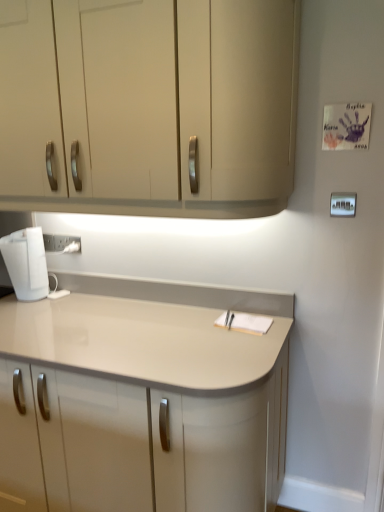
Question: Considering the relative positions of matte beige countertop at center and matte beige cabinet at upper center in the image provided, is matte beige countertop at center in front of matte beige cabinet at upper center?

Choices:
 (A) yes
 (B) no

Answer: (B)

Question: Are matte beige countertop at center and matte beige cabinet at upper center located far from each other?

Choices:
 (A) no
 (B) yes

Answer: (A)

Question: Is matte beige countertop at center oriented away from matte beige cabinet at upper center?

Choices:
 (A) no
 (B) yes

Answer: (A)

Question: From the image's perspective, is matte beige countertop at center under matte beige cabinet at upper center?

Choices:
 (A) yes
 (B) no

Answer: (A)

Question: From a real-world perspective, is matte beige countertop at center below matte beige cabinet at upper center?

Choices:
 (A) yes
 (B) no

Answer: (A)

Question: From a real-world perspective, is matte beige countertop at center over matte beige cabinet at upper center?

Choices:
 (A) no
 (B) yes

Answer: (A)

Question: Is white plastic light switch at upper right turned away from matte beige countertop at center?

Choices:
 (A) yes
 (B) no

Answer: (B)

Question: Does white plastic light switch at upper right touch matte beige countertop at center?

Choices:
 (A) no
 (B) yes

Answer: (A)

Question: Can you confirm if white plastic light switch at upper right is thinner than matte beige countertop at center?

Choices:
 (A) yes
 (B) no

Answer: (A)

Question: From the image's perspective, is white plastic light switch at upper right on matte beige countertop at center?

Choices:
 (A) no
 (B) yes

Answer: (B)

Question: Can you confirm if white plastic light switch at upper right is wider than matte beige countertop at center?

Choices:
 (A) yes
 (B) no

Answer: (B)

Question: Is white plastic light switch at upper right outside matte beige countertop at center?

Choices:
 (A) yes
 (B) no

Answer: (A)

Question: Is white plastic electric outlet at lower left completely or partially inside matte beige countertop at center?

Choices:
 (A) yes
 (B) no

Answer: (B)